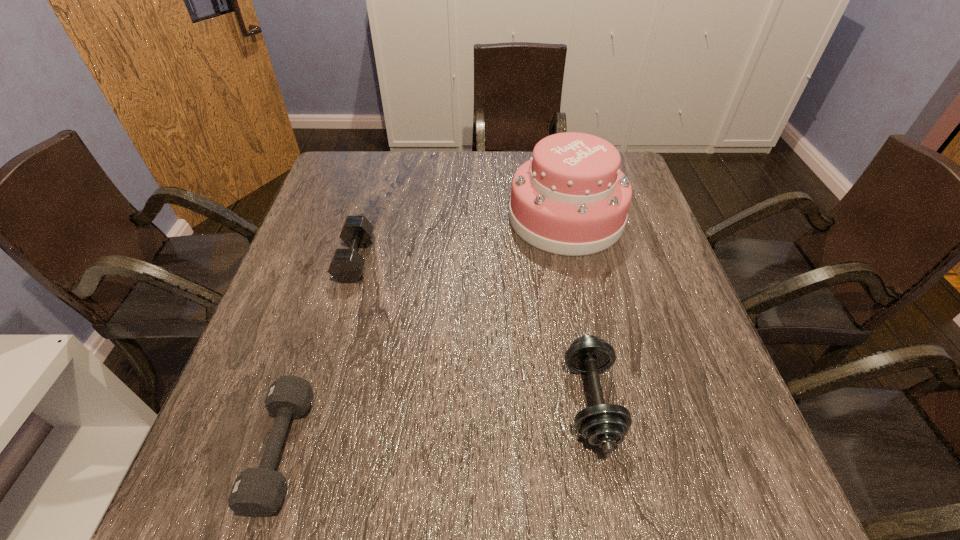
Image resolution: width=960 pixels, height=540 pixels. I want to click on vacant area that lies between the third shortest object and the farthest dumbbell, so click(473, 330).

Find the location of a particular element. Image resolution: width=960 pixels, height=540 pixels. free space between the farthest dumbbell and the cake is located at coordinates pos(461,239).

Locate an element on the screen. free point between the second tallest object and the cake is located at coordinates (579, 309).

Identify which object is the third closest to the farthest dumbbell. Please provide its 2D coordinates. Your answer should be formatted as a tuple, i.e. [(x, y)], where the tuple contains the x and y coordinates of a point satisfying the conditions above.

[(604, 425)]

Identify which object is the closest to the farthest dumbbell. Please provide its 2D coordinates. Your answer should be formatted as a tuple, i.e. [(x, y)], where the tuple contains the x and y coordinates of a point satisfying the conditions above.

[(257, 492)]

The image size is (960, 540). I want to click on dumbbell that is the closest one to the second tallest object, so click(x=257, y=492).

Locate which dumbbell is the second closest to the third shortest object. Please provide its 2D coordinates. Your answer should be formatted as a tuple, i.e. [(x, y)], where the tuple contains the x and y coordinates of a point satisfying the conditions above.

[(346, 266)]

This screenshot has width=960, height=540. What are the coordinates of `free location that satisfies the following two spatial constraints: 1. on the front side of the tallest dumbbell; 2. on the right side of the farthest dumbbell` in the screenshot? It's located at (315, 401).

At what (x,y) coordinates should I click in order to perform the action: click on vacant space that satisfies the following two spatial constraints: 1. on the front side of the farthest dumbbell; 2. on the right side of the rightmost dumbbell. Please return your answer as a coordinate pair (x, y). The image size is (960, 540). Looking at the image, I should click on (315, 401).